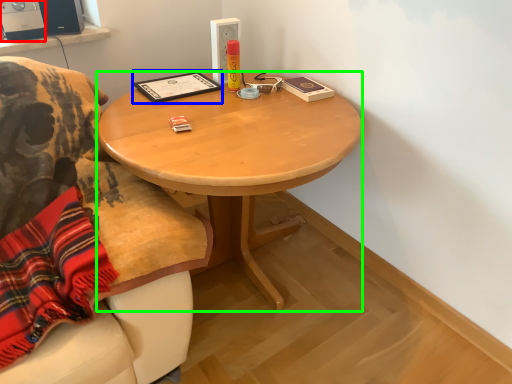
Question: Based on their relative distances, which object is nearer to loudspeaker (highlighted by a red box)? Choose from book (highlighted by a blue box) and desk (highlighted by a green box).

Choices:
 (A) book
 (B) desk

Answer: (A)